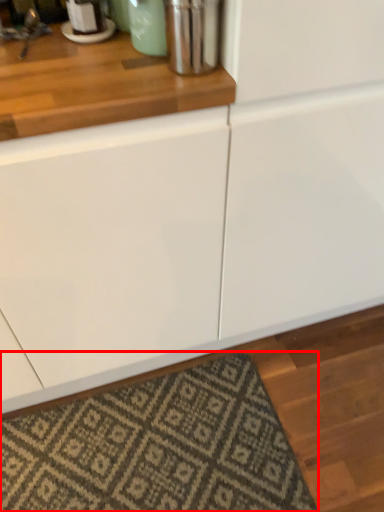
Question: From the image's perspective, where is mat (annotated by the red box) located in relation to appliance in the image?

Choices:
 (A) above
 (B) below

Answer: (B)